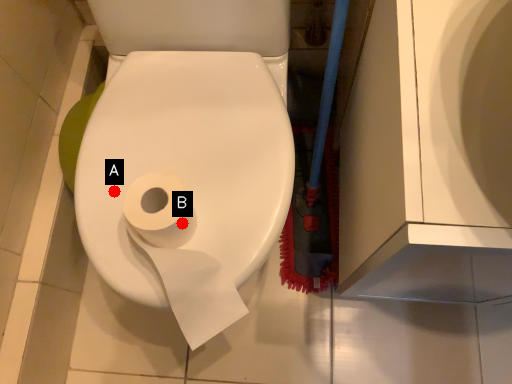
Question: Two points are circled on the image, labeled by A and B beside each circle. Which point is closer to the camera taking this photo?

Choices:
 (A) A is closer
 (B) B is closer

Answer: (B)